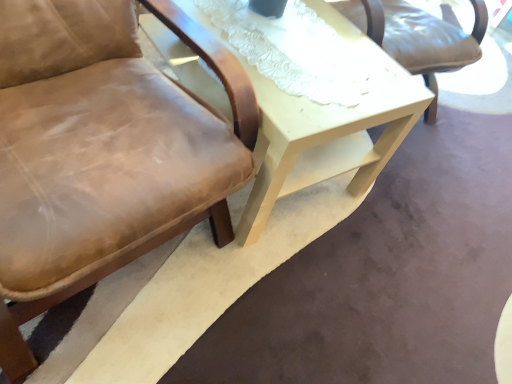
Question: In terms of width, does brown leather chair at left look wider or thinner when compared to light beige wood table at center?

Choices:
 (A) wide
 (B) thin

Answer: (B)

Question: From the image's perspective, relative to light beige wood table at center, is brown leather chair at left above or below?

Choices:
 (A) below
 (B) above

Answer: (A)

Question: Is point (200, 183) positioned closer to the camera than point (269, 175)?

Choices:
 (A) farther
 (B) closer

Answer: (B)

Question: Considering the positions of light beige wood table at center and brown leather chair at left in the image, is light beige wood table at center taller or shorter than brown leather chair at left?

Choices:
 (A) tall
 (B) short

Answer: (B)

Question: Relative to brown leather chair at left, is light beige wood table at center in front or behind?

Choices:
 (A) behind
 (B) front

Answer: (A)

Question: In terms of width, does light beige wood table at center look wider or thinner when compared to brown leather chair at left?

Choices:
 (A) thin
 (B) wide

Answer: (B)

Question: Visually, is light beige wood table at center positioned to the left or to the right of brown leather chair at left?

Choices:
 (A) right
 (B) left

Answer: (A)